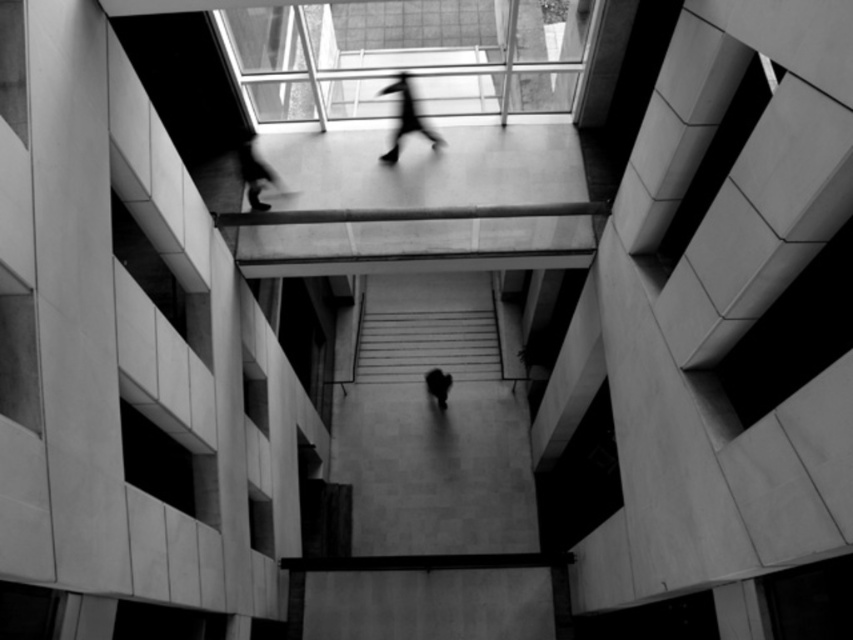
Question: Which of the following is the closest to the observer?

Choices:
 (A) (247, 154)
 (B) (427, 390)

Answer: (A)

Question: Is smooth concrete stairs at center below dark figure at center?

Choices:
 (A) no
 (B) yes

Answer: (A)

Question: Can you confirm if smooth concrete stairs at center is positioned above silhouette figure at upper center?

Choices:
 (A) no
 (B) yes

Answer: (A)

Question: Among these points, which one is farthest from the camera?

Choices:
 (A) (380, 288)
 (B) (252, 198)
 (C) (430, 392)
 (D) (409, 93)

Answer: (A)

Question: Can you confirm if smooth concrete stairs at center is positioned to the left of blurred figure at upper center?

Choices:
 (A) yes
 (B) no

Answer: (B)

Question: Which point is farther to the camera?

Choices:
 (A) blurred figure at upper center
 (B) smooth concrete stairs at center
 (C) dark figure at center
 (D) silhouette figure at upper center

Answer: (B)